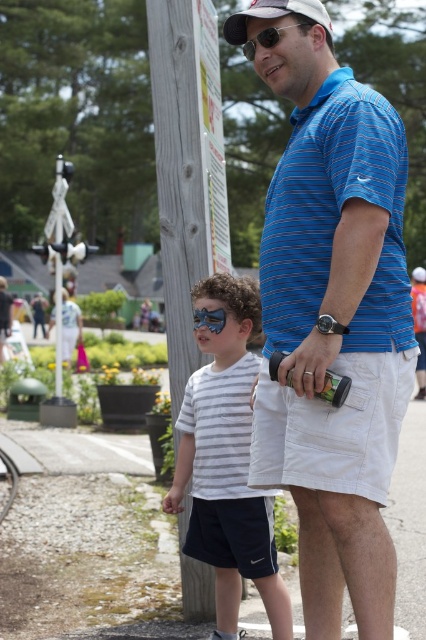
Question: Observing the image, what is the correct spatial positioning of blue striped polo shirt at center in reference to blue reflective goggles at center?

Choices:
 (A) above
 (B) below

Answer: (B)

Question: Among these objects, which one is nearest to the camera?

Choices:
 (A) blue reflective goggles at center
 (B) blue reflective plastic goggles at upper center
 (C) white fabric baseball cap at upper center

Answer: (C)

Question: Estimate the real-world distances between objects in this image. Which object is farther from the blue reflective plastic goggles at upper center?

Choices:
 (A) blue striped polo shirt at center
 (B) wooden post at center

Answer: (B)

Question: Is the position of blue striped polo shirt at center less distant than that of white striped shirt at center?

Choices:
 (A) no
 (B) yes

Answer: (B)

Question: Can you confirm if blue striped polo shirt at center is wider than blue reflective plastic goggles at upper center?

Choices:
 (A) no
 (B) yes

Answer: (B)

Question: Estimate the real-world distances between objects in this image. Which object is farther from the blue reflective plastic goggles at upper center?

Choices:
 (A) white fabric baseball cap at upper center
 (B) wooden post at center
 (C) blue striped polo shirt at center

Answer: (B)